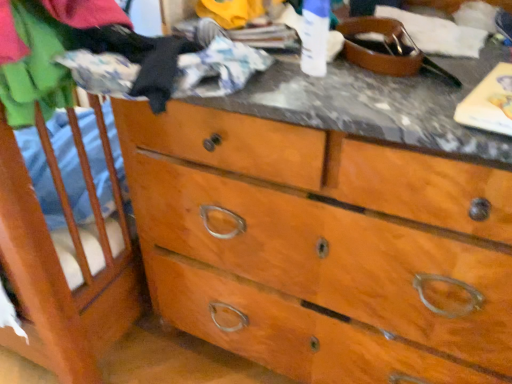
Describe the element at coordinates (305, 258) in the screenshot. I see `wooden dresser at center` at that location.

This screenshot has height=384, width=512. In order to click on wooden dresser at center in this screenshot , I will do `click(305, 258)`.

The height and width of the screenshot is (384, 512). Identify the location of soft cotton shirt at left. (42, 52).

What is the approximate height of soft cotton shirt at left?

It is 3.23 inches.

Describe the element at coordinates (42, 52) in the screenshot. I see `soft cotton shirt at left` at that location.

The width and height of the screenshot is (512, 384). I want to click on wooden dresser at center, so click(305, 258).

Can you confirm if soft cotton shirt at left is positioned to the right of wooden dresser at center?

Incorrect, soft cotton shirt at left is not on the right side of wooden dresser at center.

Which is in front, soft cotton shirt at left or wooden dresser at center?

wooden dresser at center is closer to the camera.

Which is nearer, (53,2) or (313,246)?

The point (53,2) is closer.

From the image's perspective, is soft cotton shirt at left beneath wooden dresser at center?

Actually, soft cotton shirt at left appears above wooden dresser at center in the image.

From a real-world perspective, relative to wooden dresser at center, is soft cotton shirt at left vertically above or below?

soft cotton shirt at left is situated higher than wooden dresser at center in the real world.

Can you confirm if soft cotton shirt at left is wider than wooden dresser at center?

In fact, soft cotton shirt at left might be narrower than wooden dresser at center.

Looking at this image, is soft cotton shirt at left taller or shorter than wooden dresser at center?

soft cotton shirt at left is shorter than wooden dresser at center.

Does soft cotton shirt at left have a smaller size compared to wooden dresser at center?

Indeed, soft cotton shirt at left has a smaller size compared to wooden dresser at center.

Based on the photo, would you say soft cotton shirt at left is inside or outside wooden dresser at center?

soft cotton shirt at left is located inside wooden dresser at center.

Would you consider soft cotton shirt at left to be distant from wooden dresser at center?

soft cotton shirt at left is near wooden dresser at center, not far away.

Is soft cotton shirt at left facing away from wooden dresser at center?

Yes.

Measure the distance from soft cotton shirt at left to wooden dresser at center.

soft cotton shirt at left is 15.76 inches away from wooden dresser at center.

The image size is (512, 384). Identify the location of clothing on the left of wooden dresser at center. (42, 52).

Can you confirm if wooden dresser at center is positioned to the left of soft cotton shirt at left?

Incorrect, wooden dresser at center is not on the left side of soft cotton shirt at left.

Is wooden dresser at center closer to camera compared to soft cotton shirt at left?

Yes, wooden dresser at center is closer to the viewer.

Is point (259, 143) closer to camera compared to point (29, 92)?

No, (259, 143) is further to viewer.

From the image's perspective, is wooden dresser at center located above soft cotton shirt at left?

No, from the image's perspective, wooden dresser at center is not on top of soft cotton shirt at left.

From a real-world perspective, who is located lower, wooden dresser at center or soft cotton shirt at left?

From a 3D spatial view, wooden dresser at center is below.

Does wooden dresser at center have a lesser width compared to soft cotton shirt at left?

No, wooden dresser at center is not thinner than soft cotton shirt at left.

Which of these two, wooden dresser at center or soft cotton shirt at left, stands shorter?

Standing shorter between the two is soft cotton shirt at left.

Which of these two, wooden dresser at center or soft cotton shirt at left, is smaller?

soft cotton shirt at left is smaller.

In the scene shown: Is wooden dresser at center situated inside soft cotton shirt at left or outside?

wooden dresser at center lies outside soft cotton shirt at left.

Looking at this image, is wooden dresser at center not near soft cotton shirt at left?

No.

From the picture: Is wooden dresser at center looking in the opposite direction of soft cotton shirt at left?

wooden dresser at center does not have its back to soft cotton shirt at left.

How different are the orientations of wooden dresser at center and soft cotton shirt at left in degrees?

The angular difference between wooden dresser at center and soft cotton shirt at left is 1.43 degrees.

Image resolution: width=512 pixels, height=384 pixels. I want to click on clothing behind the wooden dresser at center, so click(42, 52).

The image size is (512, 384). In the image, there is a soft cotton shirt at left. Find the location of `the chest of drawers below it (from the image's perspective)`. the chest of drawers below it (from the image's perspective) is located at coordinates (305, 258).

You are a GUI agent. You are given a task and a screenshot of the screen. Output one action in this format:
    pyautogui.click(x=<x>, y=<y>)
    Task: Click on the clothing above the wooden dresser at center (from the image's perspective)
    The image size is (512, 384).
    Given the screenshot: What is the action you would take?
    pyautogui.click(x=42, y=52)